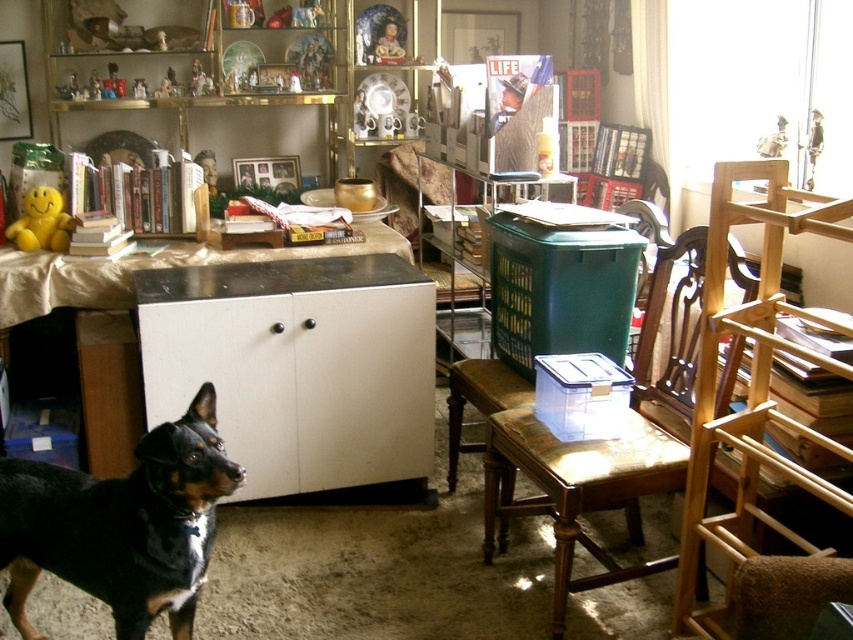
You are a cleaning robot with a width of 0.8 meters. You are positioned near the black glossy dog at lower left and want to move to the wooden chair at center. Can you navigate the space between them without hitting any obstacles?

The distance between the black glossy dog at lower left and the wooden chair at center is 1.11 meters. Since the robot is 0.8 meters wide, there is enough space for it to move through the gap as 1.11 meters is greater than 0.8 meters.

You are a delivery person who needs to place a package on the surface between the white glossy cabinet at center and the green plastic chair at center. Is there enough space to place the package between them?

The white glossy cabinet at center is positioned on the left side of green plastic chair at center, so there is space between them to place the package.

You are a visitor in this room and want to pet the black glossy dog at lower left. To reach it, you need to walk around the wooden chair at center. Is the dog located under the chair or behind it?

The black glossy dog at lower left is below wooden chair at center, so it is located under the chair.